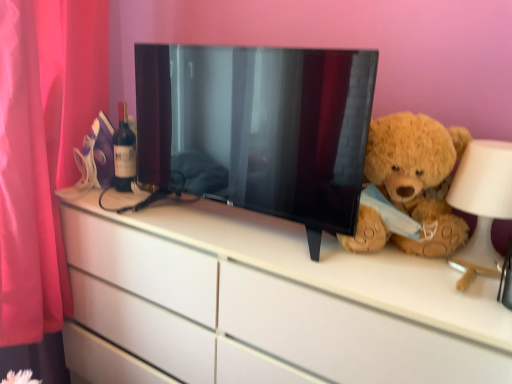
Where is `pink fabric curtain at left`? The width and height of the screenshot is (512, 384). pink fabric curtain at left is located at coordinates (42, 149).

This screenshot has height=384, width=512. Find the location of `white glossy chest of drawers at center`. white glossy chest of drawers at center is located at coordinates (297, 292).

Image resolution: width=512 pixels, height=384 pixels. What do you see at coordinates (124, 152) in the screenshot?
I see `matte glass bottle at left` at bounding box center [124, 152].

You are a GUI agent. You are given a task and a screenshot of the screen. Output one action in this format:
    pyautogui.click(x=<x>, y=<y>)
    Task: Click on the fuzzy brown teddy bear at right
    Image resolution: width=512 pixels, height=384 pixels.
    Given the screenshot: What is the action you would take?
    pyautogui.click(x=411, y=183)

Is black glossy tv at center in front of or behind fuzzy brown teddy bear at right in the image?

In the image, black glossy tv at center appears in front of fuzzy brown teddy bear at right.

In the scene shown: Considering the relative sizes of black glossy tv at center and fuzzy brown teddy bear at right in the image provided, is black glossy tv at center taller than fuzzy brown teddy bear at right?

Indeed, black glossy tv at center has a greater height compared to fuzzy brown teddy bear at right.

Is black glossy tv at center inside or outside of fuzzy brown teddy bear at right?

black glossy tv at center is located beyond the bounds of fuzzy brown teddy bear at right.

Is black glossy tv at center oriented away from fuzzy brown teddy bear at right?

No, black glossy tv at center is not facing the opposite direction of fuzzy brown teddy bear at right.

Is black glossy tv at center looking in the opposite direction of pink fabric curtain at left?

No, black glossy tv at center is not facing away from pink fabric curtain at left.

Looking at this image, does black glossy tv at center touch pink fabric curtain at left?

black glossy tv at center is not next to pink fabric curtain at left, and they're not touching.

From the image's perspective, between black glossy tv at center and pink fabric curtain at left, who is located below?

From the image's view, pink fabric curtain at left is below.

At what (x,y) coordinates should I click in order to perform the action: click on curtain located behind the black glossy tv at center. Please return your answer as a coordinate pair (x, y). This screenshot has height=384, width=512. Looking at the image, I should click on (42, 149).

Is the position of white glossy chest of drawers at center less distant than that of matte glass bottle at left?

Yes, white glossy chest of drawers at center is closer to the camera.

Is white glossy chest of drawers at center wider than matte glass bottle at left?

Correct, the width of white glossy chest of drawers at center exceeds that of matte glass bottle at left.

From a real-world perspective, is white glossy chest of drawers at center physically located above or below matte glass bottle at left?

From a real-world perspective, white glossy chest of drawers at center is physically below matte glass bottle at left.

Who is shorter, white matte table lamp at right or matte glass bottle at left?

white matte table lamp at right.

From the image's perspective, relative to matte glass bottle at left, is white matte table lamp at right above or below?

Based on their image positions, white matte table lamp at right is located beneath matte glass bottle at left.

Can you confirm if white matte table lamp at right is positioned to the left of matte glass bottle at left?

In fact, white matte table lamp at right is to the right of matte glass bottle at left.

Which of these two, white matte table lamp at right or matte glass bottle at left, is bigger?

white matte table lamp at right is bigger.

Consider the image. Is the surface of white matte table lamp at right in direct contact with fuzzy brown teddy bear at right?

No, white matte table lamp at right is not touching fuzzy brown teddy bear at right.

In the scene shown: Which is in front, white matte table lamp at right or fuzzy brown teddy bear at right?

white matte table lamp at right is in front.

Who is bigger, white matte table lamp at right or fuzzy brown teddy bear at right?

fuzzy brown teddy bear at right.

From the image's perspective, is white matte table lamp at right positioned above or below fuzzy brown teddy bear at right?

Based on their image positions, white matte table lamp at right is located beneath fuzzy brown teddy bear at right.

Based on the photo, could you tell me if black glossy tv at center is turned towards matte glass bottle at left?

No, black glossy tv at center is not oriented towards matte glass bottle at left.

Which is in front, point (313, 59) or point (114, 134)?

The point (313, 59) is closer to the camera.

From a real-world perspective, which object rests below the other?

matte glass bottle at left is physically lower.

Considering the positions of objects black glossy tv at center and matte glass bottle at left in the image provided, who is more to the right, black glossy tv at center or matte glass bottle at left?

black glossy tv at center.

Measure the distance from white glossy chest of drawers at center to white matte table lamp at right.

16.65 inches.

Is white glossy chest of drawers at center inside or outside of white matte table lamp at right?

white glossy chest of drawers at center is not inside white matte table lamp at right, it's outside.

Which object is positioned more to the right, white glossy chest of drawers at center or white matte table lamp at right?

Positioned to the right is white matte table lamp at right.

Who is smaller, white glossy chest of drawers at center or white matte table lamp at right?

white matte table lamp at right is smaller.

The height and width of the screenshot is (384, 512). In order to click on television located in front of the fuzzy brown teddy bear at right in this screenshot , I will do `click(261, 125)`.

Where is `curtain below the black glossy tv at center (from a real-world perspective)`? curtain below the black glossy tv at center (from a real-world perspective) is located at coordinates (42, 149).

Which object lies nearer to the anchor point white glossy chest of drawers at center, white matte table lamp at right or black glossy tv at center?

black glossy tv at center is positioned closer to the anchor white glossy chest of drawers at center.

Based on their spatial positions, is pink fabric curtain at left or white matte table lamp at right closer to black glossy tv at center?

Among the two, white matte table lamp at right is located nearer to black glossy tv at center.

Looking at the image, which one is located further to pink fabric curtain at left, fuzzy brown teddy bear at right or black glossy tv at center?

fuzzy brown teddy bear at right lies further to pink fabric curtain at left than the other object.

When comparing their distances from pink fabric curtain at left, does fuzzy brown teddy bear at right or white matte table lamp at right seem closer?

Among the two, fuzzy brown teddy bear at right is located nearer to pink fabric curtain at left.

Considering their positions, is black glossy tv at center positioned closer to white matte table lamp at right than matte glass bottle at left?

black glossy tv at center.

From the image, which object appears to be farther from pink fabric curtain at left, fuzzy brown teddy bear at right or matte glass bottle at left?

The object further to pink fabric curtain at left is fuzzy brown teddy bear at right.

When comparing their distances from fuzzy brown teddy bear at right, does pink fabric curtain at left or matte glass bottle at left seem closer?

Among the two, matte glass bottle at left is located nearer to fuzzy brown teddy bear at right.

From the image, which object appears to be nearer to black glossy tv at center, white matte table lamp at right or pink fabric curtain at left?

white matte table lamp at right lies closer to black glossy tv at center than the other object.

Locate an element on the screen. teddy bear situated between black glossy tv at center and white matte table lamp at right from left to right is located at coordinates (411, 183).

I want to click on teddy bear between matte glass bottle at left and white matte table lamp at right from left to right, so click(411, 183).

Image resolution: width=512 pixels, height=384 pixels. I want to click on table lamp between black glossy tv at center and white glossy chest of drawers at center from top to bottom, so click(482, 204).

The image size is (512, 384). In order to click on curtain between matte glass bottle at left and white glossy chest of drawers at center in the up-down direction in this screenshot , I will do `click(42, 149)`.